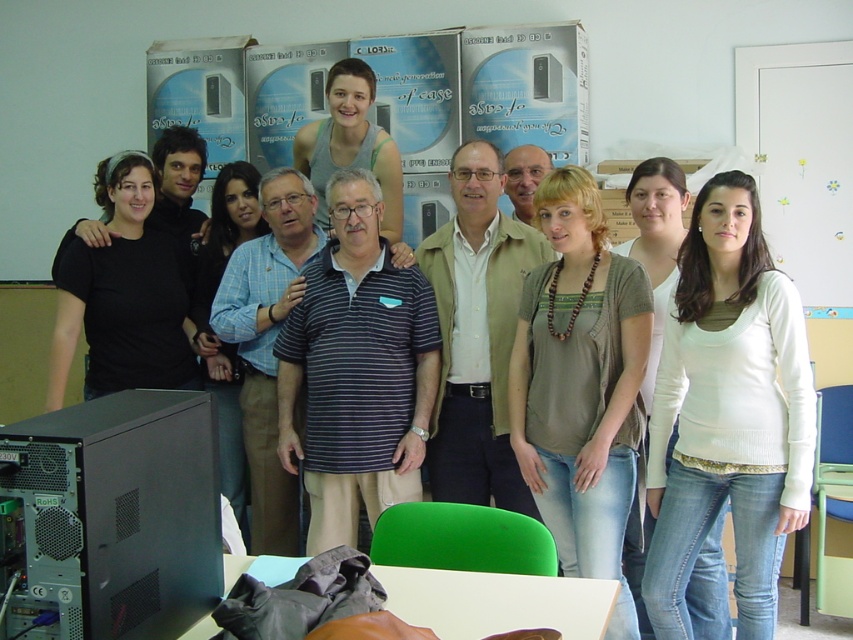
Is striped cotton polo shirt at center to the left of blue plaid shirt at center from the viewer's perspective?

In fact, striped cotton polo shirt at center is to the right of blue plaid shirt at center.

Identify the location of striped cotton polo shirt at center. Image resolution: width=853 pixels, height=640 pixels. (357, 371).

Identify the location of striped cotton polo shirt at center. (357, 371).

You are a GUI agent. You are given a task and a screenshot of the screen. Output one action in this format:
    pyautogui.click(x=<x>, y=<y>)
    Task: Click on the striped cotton polo shirt at center
    The image size is (853, 640).
    Given the screenshot: What is the action you would take?
    pyautogui.click(x=357, y=371)

Is white soft sweater at center bigger than matte gray tank top at center?

Yes.

Who is positioned more to the right, white soft sweater at center or matte gray tank top at center?

Positioned to the right is white soft sweater at center.

Which is in front, point (764, 506) or point (321, 161)?

Point (764, 506) is more forward.

I want to click on white soft sweater at center, so click(728, 412).

Looking at this image, can you confirm if matte brown necklace at center is thinner than blue plaid shirt at center?

No.

Between point (514, 378) and point (207, 376), which one is positioned in front?

Point (514, 378) is more forward.

Which is behind, point (552, 228) or point (207, 256)?

Point (207, 256)

This screenshot has height=640, width=853. I want to click on matte brown necklace at center, so click(579, 385).